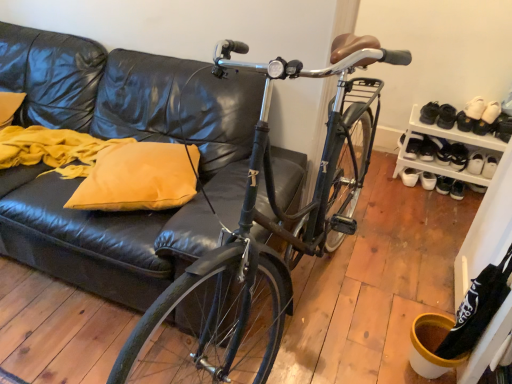
Question: Is white suede shoes at upper right, which ranks as the sixth footwear in left-to-right order, at the left side of white matte sneakers at lower right, which ranks as the eighth footwear in right-to-left order?

Choices:
 (A) yes
 (B) no

Answer: (B)

Question: From a real-world perspective, is white suede shoes at upper right, acting as the 4th footwear starting from the right, below white matte sneakers at lower right, which ranks as the 2th footwear in left-to-right order?

Choices:
 (A) yes
 (B) no

Answer: (B)

Question: Is white suede shoes at upper right, acting as the 4th footwear starting from the right, bigger than white matte sneakers at lower right, which ranks as the 2th footwear in left-to-right order?

Choices:
 (A) no
 (B) yes

Answer: (B)

Question: Can white matte sneakers at lower right, which ranks as the 2th footwear in left-to-right order, be found inside white suede shoes at upper right, acting as the 4th footwear starting from the right?

Choices:
 (A) no
 (B) yes

Answer: (A)

Question: Is white suede shoes at upper right, which ranks as the sixth footwear in left-to-right order, shorter than white matte sneakers at lower right, which ranks as the 2th footwear in left-to-right order?

Choices:
 (A) no
 (B) yes

Answer: (A)

Question: From the image's perspective, would you say white suede shoes at upper right, which ranks as the sixth footwear in left-to-right order, is shown under white matte sneakers at lower right, which ranks as the eighth footwear in right-to-left order?

Choices:
 (A) no
 (B) yes

Answer: (A)

Question: From a real-world perspective, is yellow fabric pillow at left physically below white leather shoe at right, which is the eighth footwear in left-to-right order?

Choices:
 (A) no
 (B) yes

Answer: (A)

Question: Could you tell me if yellow fabric pillow at left is turned towards white leather shoe at right, which is the second footwear in right-to-left order?

Choices:
 (A) yes
 (B) no

Answer: (B)

Question: Does yellow fabric pillow at left appear on the right side of white leather shoe at right, which is the second footwear in right-to-left order?

Choices:
 (A) yes
 (B) no

Answer: (B)

Question: Can you confirm if yellow fabric pillow at left is wider than white leather shoe at right, which is the eighth footwear in left-to-right order?

Choices:
 (A) no
 (B) yes

Answer: (B)

Question: From a real-world perspective, is yellow fabric pillow at left physically above white leather shoe at right, which is the eighth footwear in left-to-right order?

Choices:
 (A) yes
 (B) no

Answer: (A)

Question: Is white leather shoe at right, which is the second footwear in right-to-left order, completely or partially inside yellow fabric pillow at left?

Choices:
 (A) no
 (B) yes

Answer: (A)

Question: Considering the relative sizes of white leather shoe at lower right, positioned as the 1th footwear in right-to-left order, and white leather shoe at right, the 2th shoe viewed from the right, in the image provided, is white leather shoe at lower right, positioned as the 1th footwear in right-to-left order, shorter than white leather shoe at right, the 2th shoe viewed from the right,?

Choices:
 (A) yes
 (B) no

Answer: (A)